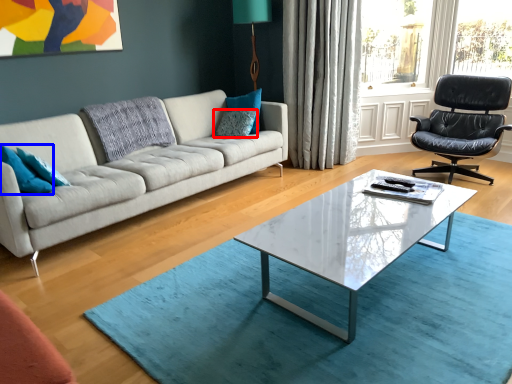
Question: Which object is closer to the camera taking this photo, pillow (highlighted by a red box) or pillow (highlighted by a blue box)?

Choices:
 (A) pillow
 (B) pillow

Answer: (B)